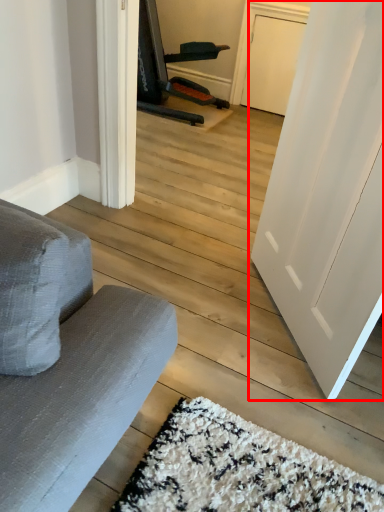
Question: From the image's perspective, where is door (annotated by the red box) located in relation to armchair in the image?

Choices:
 (A) above
 (B) below

Answer: (B)